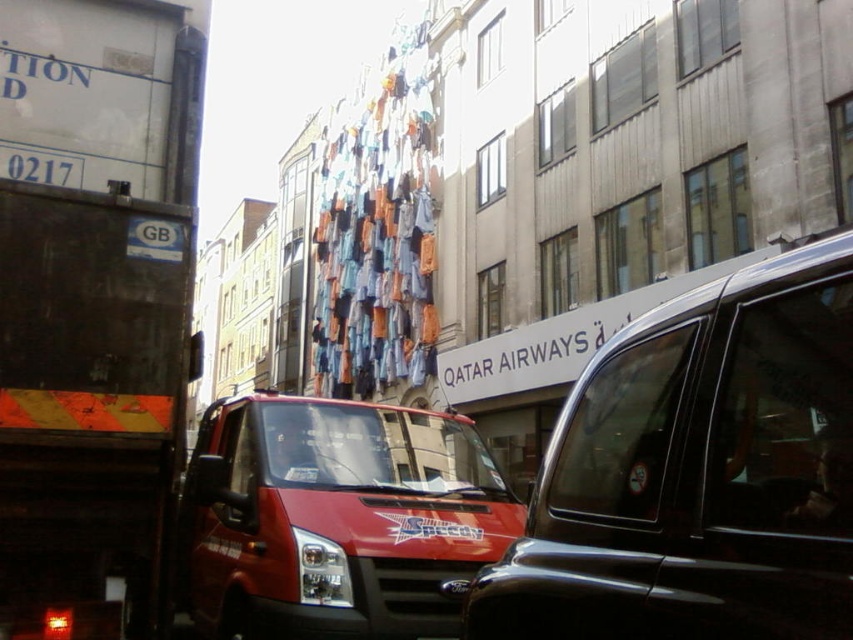
You are standing at the center of the street in the image. There is a point marked at coordinates [94,307]. Which object does this point correspond to?

The point at coordinates [94,307] corresponds to the matte black truck at left.